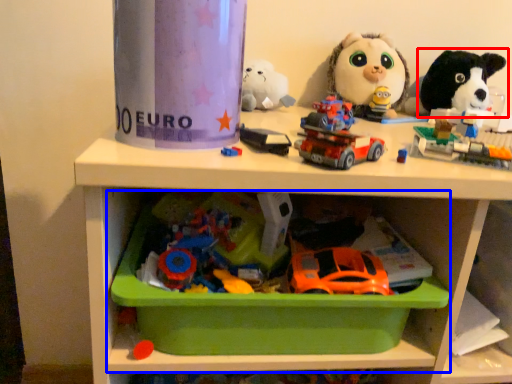
Question: Which of the following is the closest to the observer, toy (highlighted by a red box) or shelf (highlighted by a blue box)?

Choices:
 (A) toy
 (B) shelf

Answer: (B)